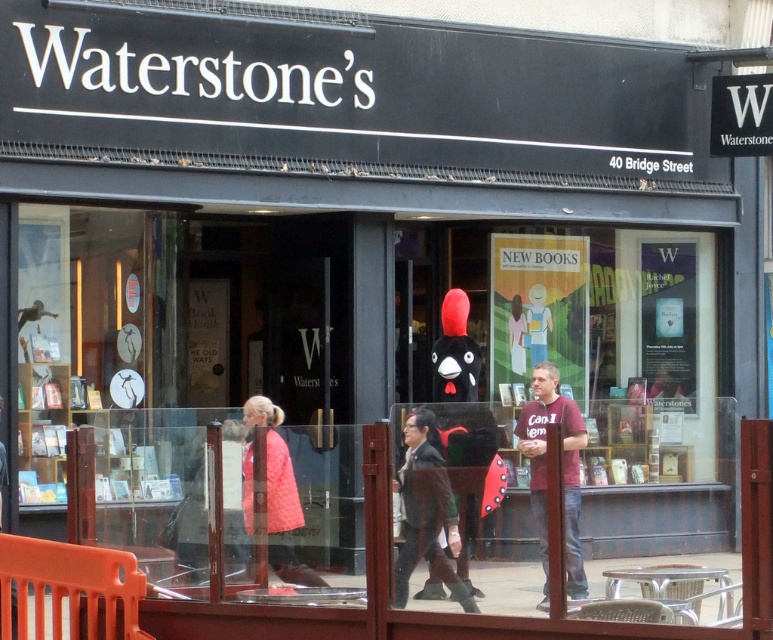
Looking at this image, you are a fashion blogger who wants to feature both the dark brown leather jacket at center and the quilted pink coat at center in your post. You need to know which one is bigger to describe them accurately. Which one is larger?

The dark brown leather jacket at center is larger in size than the quilted pink coat at center.

You are standing at the entrance of the Waterstone bookstore on 40 Bridge Street. You notice two points marked on the ground in front of you. The first point is at coordinate point(404,536) and the second is at point(569,412). If you were to walk from the first point to the second point, would you be moving towards the entrance or away from it?

Since point(404,536) is in front of point(569,412), moving from the first point to the second would mean moving away from the entrance towards the seating area.